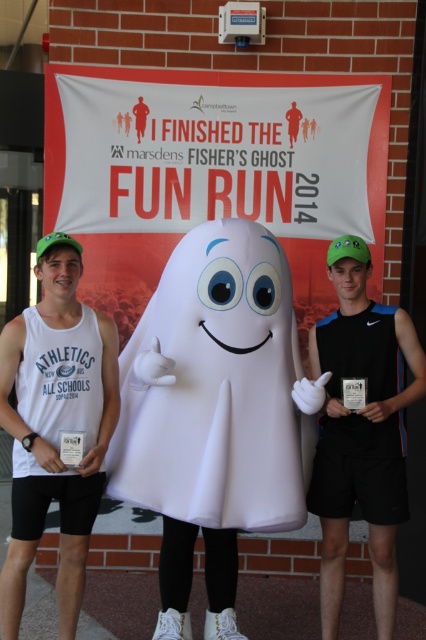
Which is more to the right, white fabric ghost at center or white matte tank top at left?

From the viewer's perspective, white fabric ghost at center appears more on the right side.

Between white fabric ghost at center and white matte tank top at left, which one has more height?

white matte tank top at left is taller.

Which is in front, point (264, 353) or point (46, 504)?

Point (46, 504)

Find the location of a particular element. The image size is (426, 640). white fabric ghost at center is located at coordinates (215, 388).

Consider the image. Is white matte tank top at left to the left of black matte tank top at center from the viewer's perspective?

Indeed, white matte tank top at left is positioned on the left side of black matte tank top at center.

Does white matte tank top at left have a greater height compared to black matte tank top at center?

In fact, white matte tank top at left may be shorter than black matte tank top at center.

Who is more forward, (97, 396) or (399, 397)?

Positioned in front is point (97, 396).

The image size is (426, 640). Find the location of `white matte tank top at left`. white matte tank top at left is located at coordinates (55, 426).

Measure the distance from white fabric ghost at center to black matte tank top at center.

They are 22.11 inches apart.

Can you confirm if white fabric ghost at center is positioned to the left of black matte tank top at center?

Indeed, white fabric ghost at center is positioned on the left side of black matte tank top at center.

Measure the distance between point (235,310) and camera.

3.26 meters

Identify the location of white fabric ghost at center. Image resolution: width=426 pixels, height=640 pixels. (215, 388).